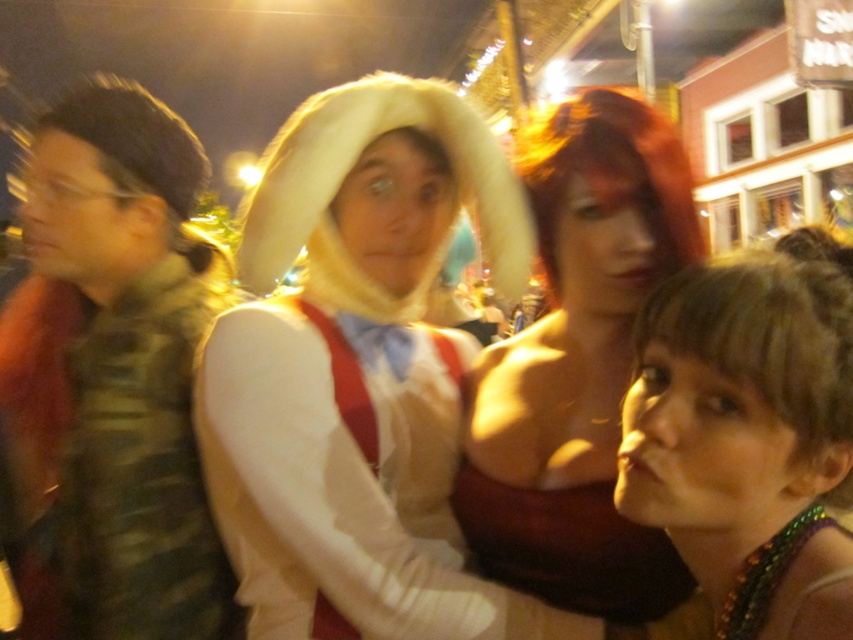
Question: Which is farther from the shiny green necklace at lower right?

Choices:
 (A) shiny red hair at center
 (B) camouflage fabric vest at left

Answer: (B)

Question: Which point is farther to the camera?

Choices:
 (A) shiny green necklace at lower right
 (B) camouflage fabric vest at left
 (C) shiny red hair at center

Answer: (B)

Question: Which object appears farthest from the camera in this image?

Choices:
 (A) camouflage fabric vest at left
 (B) shiny green necklace at lower right

Answer: (A)

Question: Does camouflage fabric vest at left come in front of shiny red hair at center?

Choices:
 (A) yes
 (B) no

Answer: (B)

Question: Is camouflage fabric vest at left wider than shiny green necklace at lower right?

Choices:
 (A) no
 (B) yes

Answer: (B)

Question: Does camouflage fabric vest at left appear over shiny green necklace at lower right?

Choices:
 (A) no
 (B) yes

Answer: (B)